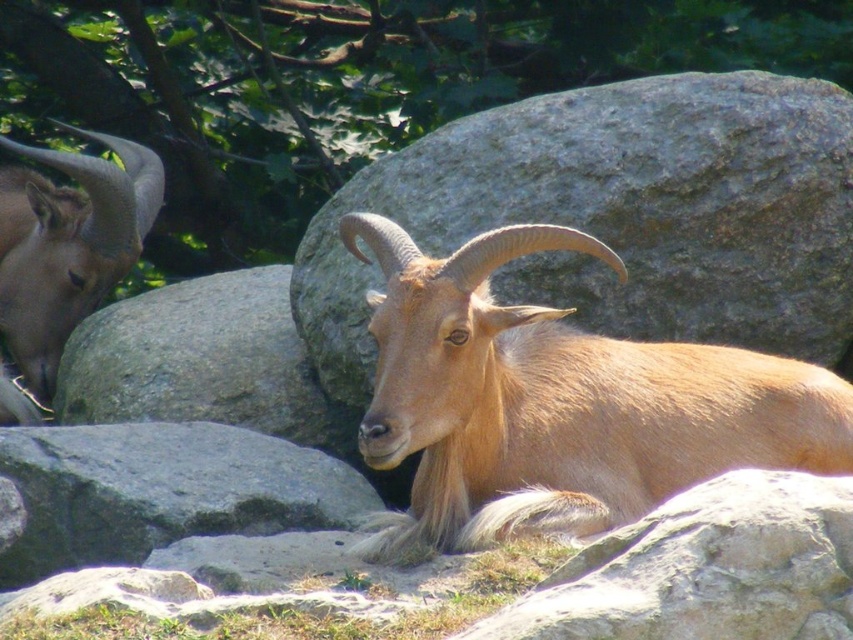
You are a photographer trying to capture the golden fur goat at center and the gray rough rock at lower right in the same frame. Based on their positions, which object would appear closer to the camera in the photo?

The golden fur goat at center is located above the gray rough rock at lower right, so it would appear closer to the camera in the photo.

You are a photographer trying to capture both the gray rough rock at lower left and the brown woolen goat at left in a single frame. Based on their sizes, which object should you focus on first to ensure both fit in the shot?

The gray rough rock at lower left might be wider than the brown woolen goat at left, so focusing on the gray rough rock at lower left first would help ensure both fit in the frame since it could be the larger object.

You are a hiker who wants to take a photo of both the golden fur goat at center and the brown woolen goat at left. Which goat should you move closer to if you want to include both in your frame without zooming in?

You should move closer to the brown woolen goat at left because the golden fur goat at center is to the right of it, so moving towards the left goat will help include both in the frame.